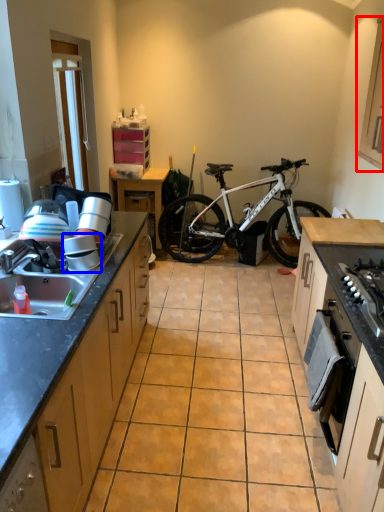
Question: Which object appears farthest to the camera in this image, cabinetry (highlighted by a red box) or appliance (highlighted by a blue box)?

Choices:
 (A) cabinetry
 (B) appliance

Answer: (B)